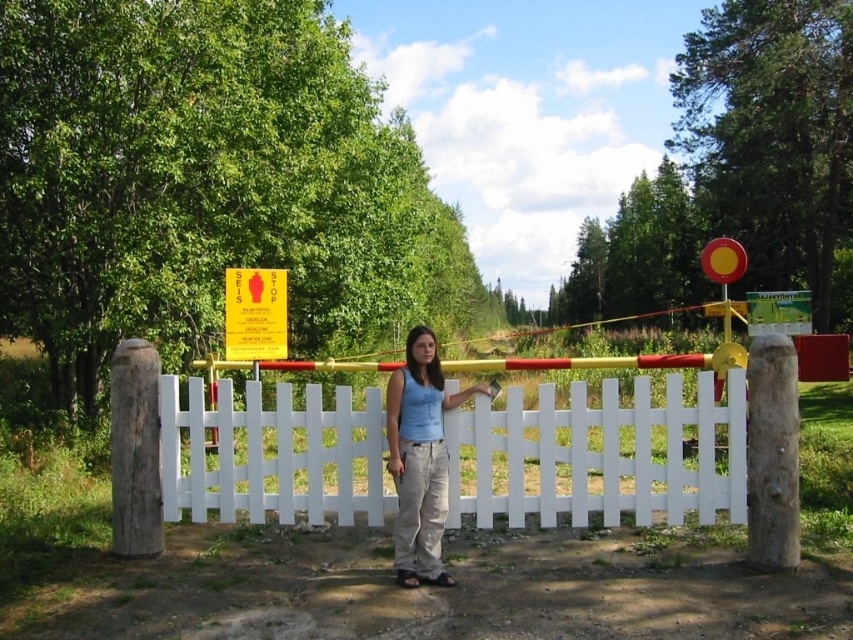
Is point (460, 403) farther from viewer compared to point (236, 346)?

No.

Which of these two, light blue cotton shirt at center or yellow plastic sign at upper center, stands shorter?

With less height is yellow plastic sign at upper center.

I want to click on light blue cotton shirt at center, so click(421, 458).

Find the location of a particular element. This screenshot has height=640, width=853. white wooden fence at center is located at coordinates (598, 456).

This screenshot has height=640, width=853. In order to click on white wooden fence at center in this screenshot , I will do [x=598, y=456].

Can you confirm if white wooden fence at center is shorter than light blue cotton shirt at center?

Correct, white wooden fence at center is not as tall as light blue cotton shirt at center.

Looking at this image, does white wooden fence at center appear under light blue cotton shirt at center?

Yes.

Is point (379, 432) positioned in front of point (433, 413)?

That is False.

Locate an element on the screen. white wooden fence at center is located at coordinates (598, 456).